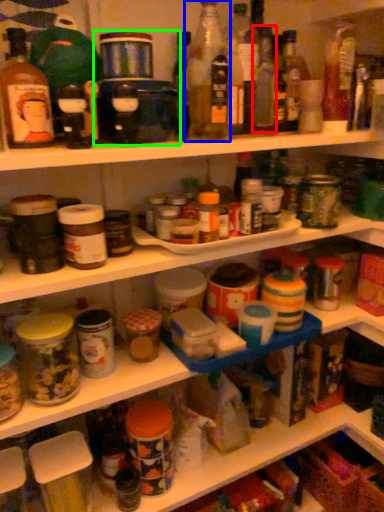
Question: Which object is positioned farthest from bottle (highlighted by a red box)? Select from bottle (highlighted by a blue box) and appliance (highlighted by a green box).

Choices:
 (A) bottle
 (B) appliance

Answer: (B)